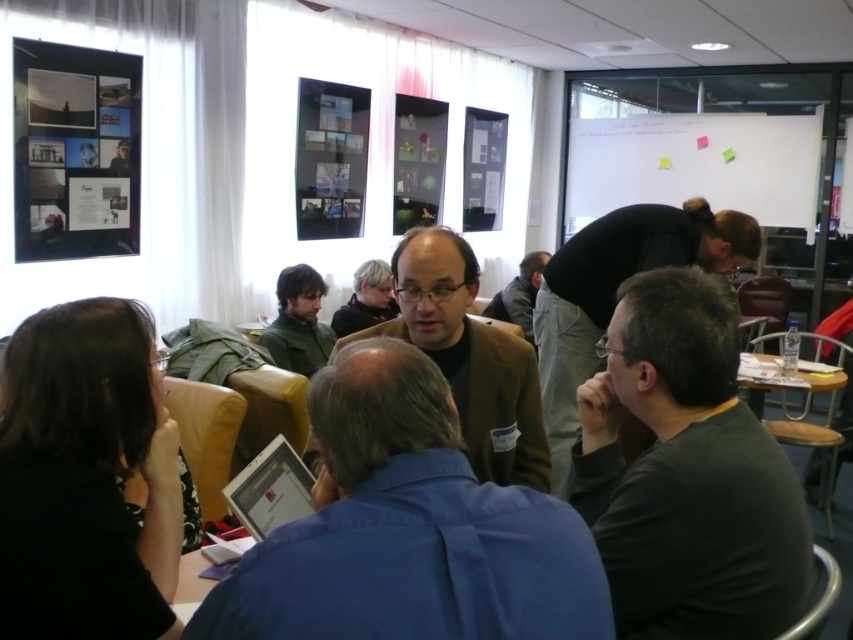
Can you confirm if dark gray shirt at center is positioned below green fabric jacket at center?

A: No, dark gray shirt at center is not below green fabric jacket at center.

Can you confirm if dark gray shirt at center is shorter than green fabric jacket at center?

No, dark gray shirt at center is not shorter than green fabric jacket at center.

Is point (585, 237) positioned in front of point (285, 349)?

That is True.

Identify the location of dark gray shirt at center. (614, 292).

The height and width of the screenshot is (640, 853). What do you see at coordinates (299, 323) in the screenshot?
I see `green fabric jacket at center` at bounding box center [299, 323].

Who is more forward, (318, 365) or (496, 296)?

Point (318, 365) is in front.

Between point (292, 276) and point (502, 317), which one is positioned in front?

Point (292, 276) is in front.

You are a GUI agent. You are given a task and a screenshot of the screen. Output one action in this format:
    pyautogui.click(x=<x>, y=<y>)
    Task: Click on the green fabric jacket at center
    This screenshot has height=640, width=853.
    Given the screenshot: What is the action you would take?
    pyautogui.click(x=299, y=323)

Which of these two, blue fabric shirt at center or matte brown jacket at center, stands taller?

With more height is matte brown jacket at center.

Can you confirm if blue fabric shirt at center is shorter than matte brown jacket at center?

Yes, blue fabric shirt at center is shorter than matte brown jacket at center.

Locate an element on the screen. blue fabric shirt at center is located at coordinates (409, 529).